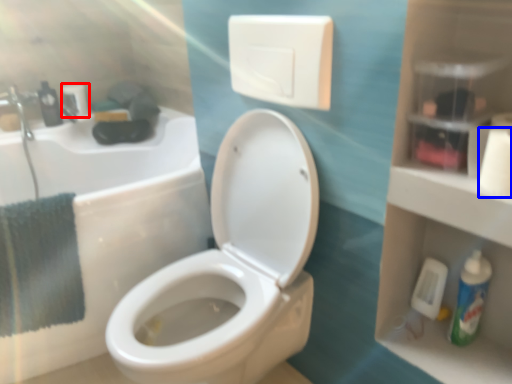
Question: Among these objects, which one is farthest to the camera, toilet paper (highlighted by a red box) or toilet paper (highlighted by a blue box)?

Choices:
 (A) toilet paper
 (B) toilet paper

Answer: (A)